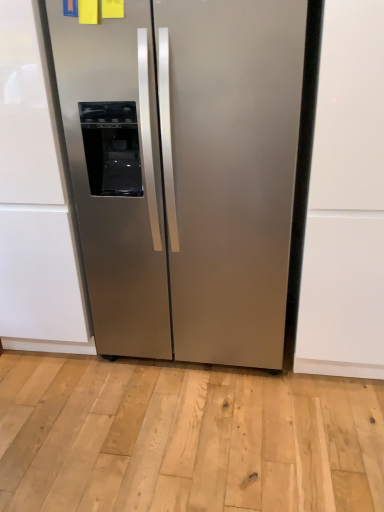
Describe the element at coordinates (184, 170) in the screenshot. The width and height of the screenshot is (384, 512). I see `stainless steel refrigerator at center` at that location.

The width and height of the screenshot is (384, 512). What are the coordinates of `stainless steel refrigerator at center` in the screenshot? It's located at (184, 170).

The width and height of the screenshot is (384, 512). Find the location of `stainless steel refrigerator at center`. stainless steel refrigerator at center is located at coordinates (184, 170).